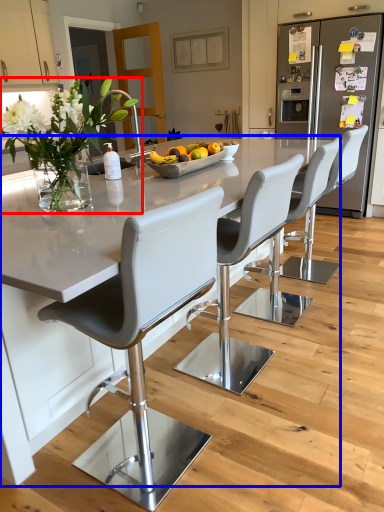
Question: Which point is closer to the camera, floral arrangement (highlighted by a red box) or kitchen & dining room table (highlighted by a blue box)?

Choices:
 (A) floral arrangement
 (B) kitchen & dining room table

Answer: (B)